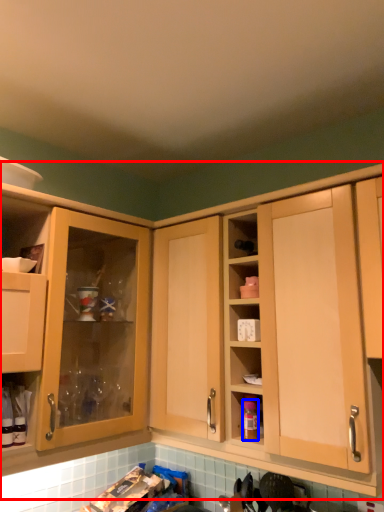
Question: Among these objects, which one is farthest to the camera, cabinetry (highlighted by a red box) or bottle (highlighted by a blue box)?

Choices:
 (A) cabinetry
 (B) bottle

Answer: (B)